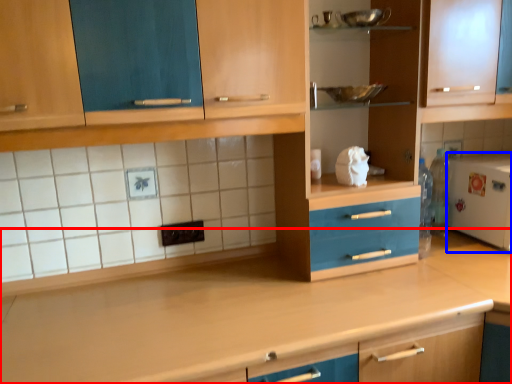
Question: Which point is closer to the camera, countertop (highlighted by a red box) or appliance (highlighted by a blue box)?

Choices:
 (A) countertop
 (B) appliance

Answer: (A)